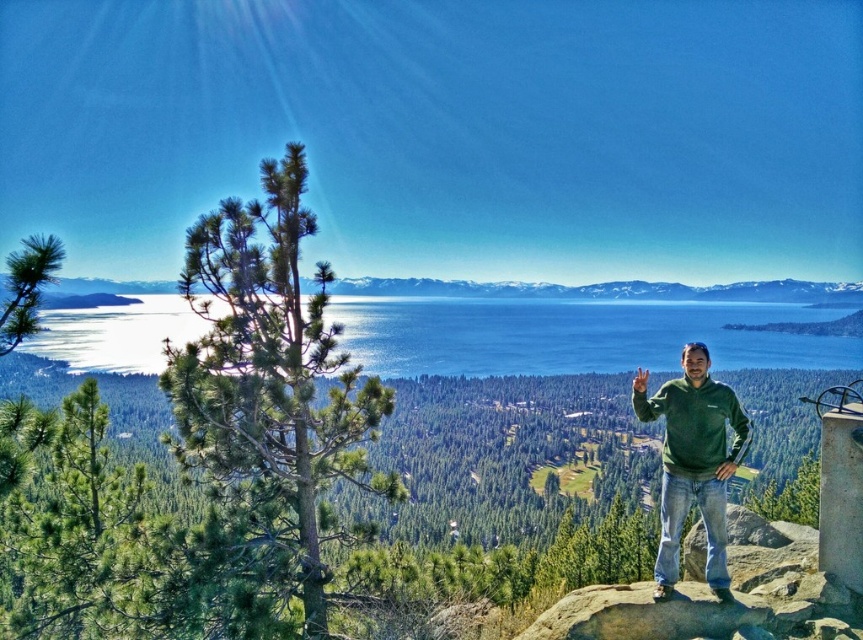
Question: Is blue water at center below snowy mountain at center?

Choices:
 (A) yes
 (B) no

Answer: (A)

Question: Which point appears closest to the camera in this image?

Choices:
 (A) (341, 282)
 (B) (679, 518)

Answer: (B)

Question: Which object appears farthest from the camera in this image?

Choices:
 (A) snowy mountain at center
 (B) blue water at center
 (C) green fleece at right

Answer: (B)

Question: Does blue water at center have a lesser width compared to snowy mountain at center?

Choices:
 (A) no
 (B) yes

Answer: (B)

Question: Can you confirm if blue water at center is positioned to the left of snowy mountain at center?

Choices:
 (A) no
 (B) yes

Answer: (B)

Question: Which point is closer to the camera?

Choices:
 (A) (666, 513)
 (B) (614, 310)
 (C) (61, 280)

Answer: (A)